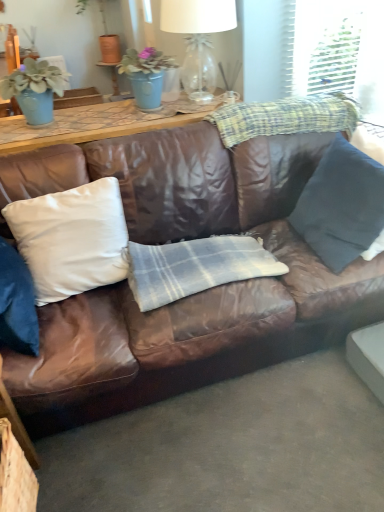
Question: Can you see dark blue fabric pillow at right, the second pillow when ordered from left to right, touching clear glass lampshade at upper center?

Choices:
 (A) yes
 (B) no

Answer: (B)

Question: Would you consider dark blue fabric pillow at right, the second pillow when ordered from left to right, to be distant from clear glass lampshade at upper center?

Choices:
 (A) no
 (B) yes

Answer: (B)

Question: Considering the relative positions of dark blue fabric pillow at right, placed as the 1th pillow when sorted from right to left, and clear glass lampshade at upper center in the image provided, is dark blue fabric pillow at right, placed as the 1th pillow when sorted from right to left, behind clear glass lampshade at upper center?

Choices:
 (A) no
 (B) yes

Answer: (A)

Question: Is dark blue fabric pillow at right, placed as the 1th pillow when sorted from right to left, looking in the opposite direction of clear glass lampshade at upper center?

Choices:
 (A) yes
 (B) no

Answer: (B)

Question: From the image's perspective, would you say dark blue fabric pillow at right, placed as the 1th pillow when sorted from right to left, is positioned over clear glass lampshade at upper center?

Choices:
 (A) no
 (B) yes

Answer: (A)

Question: From the image's perspective, is clear glass lampshade at upper center above or below matte blue pot at upper center, the second houseplant from the left?

Choices:
 (A) above
 (B) below

Answer: (A)

Question: Is point (201, 14) positioned closer to the camera than point (122, 65)?

Choices:
 (A) farther
 (B) closer

Answer: (A)

Question: From a real-world perspective, is clear glass lampshade at upper center positioned above or below matte blue pot at upper center, the second houseplant from the left?

Choices:
 (A) above
 (B) below

Answer: (A)

Question: Based on their positions, is clear glass lampshade at upper center located to the left or right of matte blue pot at upper center, arranged as the first houseplant when viewed from the right?

Choices:
 (A) right
 (B) left

Answer: (A)

Question: From a real-world perspective, is plaid fabric at upper right, which ranks as the 1th plaid in top-to-bottom order, above or below white satin pillow at center, the first pillow in the left-to-right sequence?

Choices:
 (A) below
 (B) above

Answer: (B)

Question: Would you say plaid fabric at upper right, the second plaid in the bottom-to-top sequence, is to the left or to the right of white satin pillow at center, which is the 2th pillow from right to left, in the picture?

Choices:
 (A) left
 (B) right

Answer: (B)

Question: In terms of height, does plaid fabric at upper right, which ranks as the 1th plaid in top-to-bottom order, look taller or shorter compared to white satin pillow at center, which is the 2th pillow from right to left?

Choices:
 (A) short
 (B) tall

Answer: (A)

Question: Does point (261, 121) appear closer or farther from the camera than point (34, 208)?

Choices:
 (A) farther
 (B) closer

Answer: (A)

Question: Based on their positions, is dark blue fabric pillow at right, placed as the 1th pillow when sorted from right to left, located to the left or right of clear glass lampshade at upper center?

Choices:
 (A) right
 (B) left

Answer: (A)

Question: From a real-world perspective, is dark blue fabric pillow at right, placed as the 1th pillow when sorted from right to left, physically located above or below clear glass lampshade at upper center?

Choices:
 (A) below
 (B) above

Answer: (A)